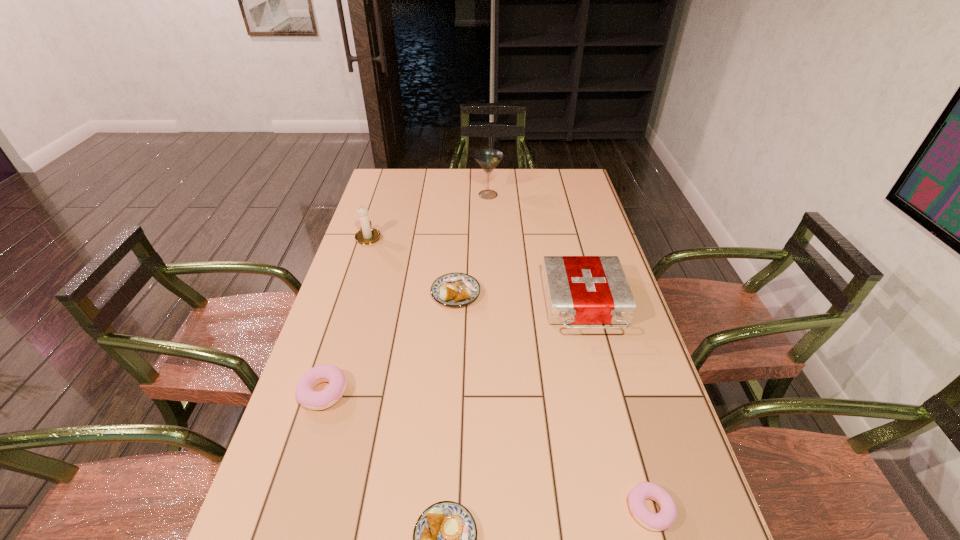
This screenshot has width=960, height=540. I want to click on brown pastry that can be found as the second closest to the red first-aid kit, so click(445, 535).

Where is `vacant space that satisfies the following two spatial constraints: 1. on the front side of the first-aid kit; 2. on the left side of the shortest pastry`? vacant space that satisfies the following two spatial constraints: 1. on the front side of the first-aid kit; 2. on the left side of the shortest pastry is located at coordinates (636, 509).

Find the location of a particular element. This screenshot has width=960, height=540. free space that satisfies the following two spatial constraints: 1. on the front side of the third tallest object; 2. on the left side of the shortest object is located at coordinates (636, 509).

Image resolution: width=960 pixels, height=540 pixels. Find the location of `vacant position in the image that satisfies the following two spatial constraints: 1. on the handle side of the martini; 2. on the right side of the white candle holder`. vacant position in the image that satisfies the following two spatial constraints: 1. on the handle side of the martini; 2. on the right side of the white candle holder is located at coordinates (382, 194).